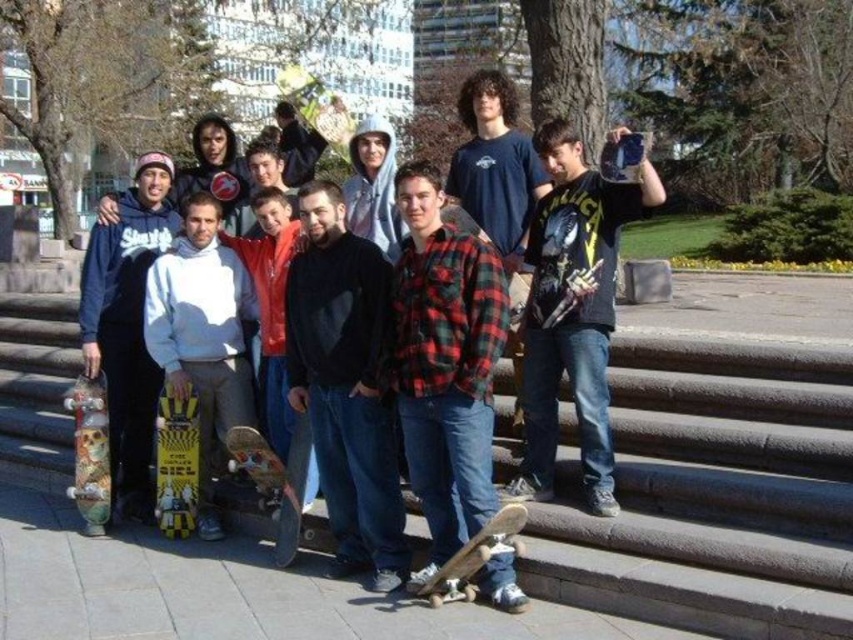
Question: Which of the following is the farthest from the observer?

Choices:
 (A) (515, 515)
 (B) (282, 547)
 (C) (335, 248)

Answer: (B)

Question: From the image, what is the correct spatial relationship of wooden skateboard at center in relation to wooden skateboard at lower center?

Choices:
 (A) below
 (B) above

Answer: (B)

Question: Does dark gray t-shirt at center appear on the left side of matte black hoodie at left?

Choices:
 (A) yes
 (B) no

Answer: (B)

Question: Which point is farther to the camera?

Choices:
 (A) black matte hoodie at center
 (B) red plaid shirt at center
 (C) skull-patterned wood skateboard at lower left

Answer: (C)

Question: Among these points, which one is nearest to the camera?

Choices:
 (A) (86, 456)
 (B) (283, 524)

Answer: (B)

Question: Does wooden skateboard at center have a smaller size compared to yellowwoodenskateboard at center?

Choices:
 (A) yes
 (B) no

Answer: (B)